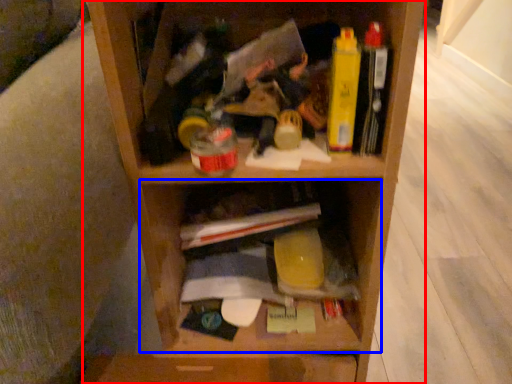
Question: Which object is closer to the camera taking this photo, shelf (highlighted by a red box) or cabinet (highlighted by a blue box)?

Choices:
 (A) shelf
 (B) cabinet

Answer: (A)